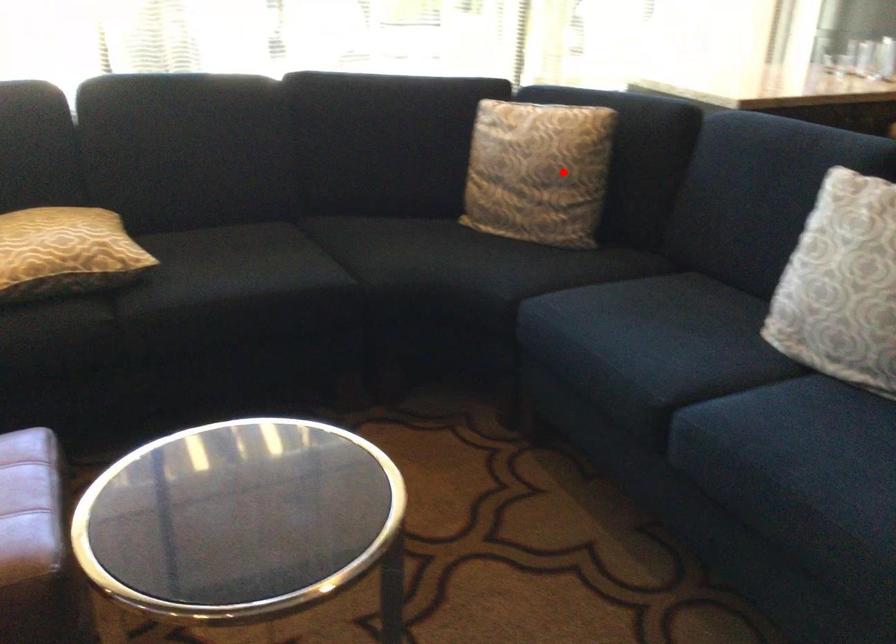
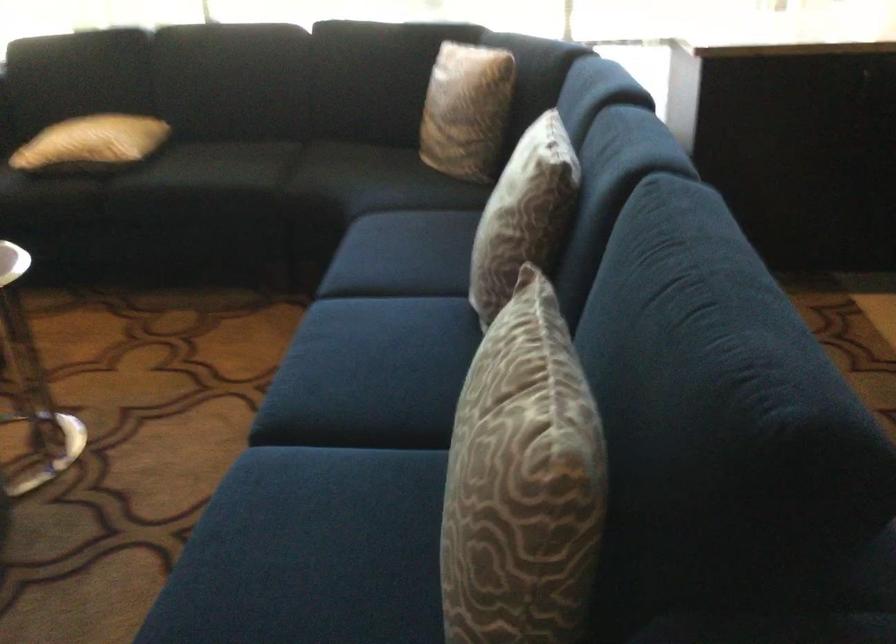
Question: I am providing you with two images of the same scene from different viewpoints. A red point is marked on the first image. Is the red point's position out of view in image 2?

Choices:
 (A) Yes
 (B) No

Answer: (B)